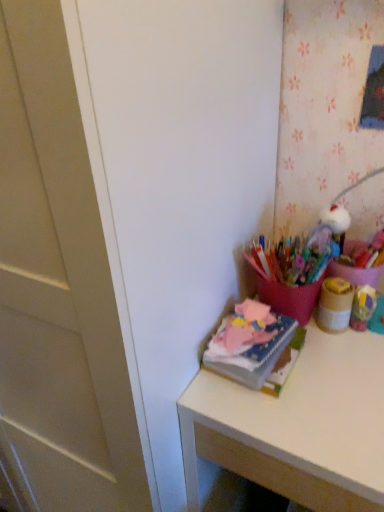
Image resolution: width=384 pixels, height=512 pixels. Identify the location of matte pink desk at right. (297, 426).

What are the coordinates of `soft pink fabric at upper right` in the screenshot? It's located at (249, 344).

From the picture: Measure the distance from matte brown jar at upper right to matte pink desk at right.

A distance of 22.34 centimeters exists between matte brown jar at upper right and matte pink desk at right.

Can you tell me how much matte brown jar at upper right and matte pink desk at right differ in facing direction?

They differ by 0.00192 degrees in their facing directions.

From the image's perspective, is matte brown jar at upper right located above or below matte pink desk at right?

matte brown jar at upper right is above matte pink desk at right.

Is matte brown jar at upper right bigger or smaller than matte pink desk at right?

In the image, matte brown jar at upper right appears to be smaller than matte pink desk at right.

Considering the relative sizes of matte pink desk at right and matte brown jar at upper right in the image provided, is matte pink desk at right thinner than matte brown jar at upper right?

No.

From the image's perspective, relative to matte brown jar at upper right, is matte pink desk at right above or below?

From the image's perspective, matte pink desk at right appears below matte brown jar at upper right.

Is matte pink desk at right not near matte brown jar at upper right?

They are positioned close to each other.

Is there a large distance between soft pink fabric at upper right and matte brown jar at upper right?

soft pink fabric at upper right is actually quite close to matte brown jar at upper right.

Considering the relative sizes of soft pink fabric at upper right and matte brown jar at upper right in the image provided, is soft pink fabric at upper right shorter than matte brown jar at upper right?

Yes.

Is soft pink fabric at upper right positioned beyond the bounds of matte brown jar at upper right?

That's correct, soft pink fabric at upper right is outside of matte brown jar at upper right.

From a real-world perspective, is soft pink fabric at upper right physically below matte pink desk at right?

No, from a real-world perspective, soft pink fabric at upper right is not under matte pink desk at right.

Consider the image. From the image's perspective, which is below, soft pink fabric at upper right or matte pink desk at right?

matte pink desk at right appears lower in the image.

Is soft pink fabric at upper right not close to matte pink desk at right?

That's not correct — soft pink fabric at upper right is a little close to matte pink desk at right.

Which is closer to the camera, [227,353] or [379,507]?

Positioned in front is point [379,507].

Is matte pink desk at right not near soft pink fabric at upper right?

No.

Can you confirm if matte pink desk at right is positioned to the right of soft pink fabric at upper right?

Correct, you'll find matte pink desk at right to the right of soft pink fabric at upper right.

Is matte pink desk at right further to camera compared to soft pink fabric at upper right?

No, it is in front of soft pink fabric at upper right.

In the image, there is a matte pink desk at right. Where is `book above it (from the image's perspective)`? book above it (from the image's perspective) is located at coordinates (249, 344).

Based on the photo, does matte brown jar at upper right appear on the right side of soft pink fabric at upper right?

Indeed, matte brown jar at upper right is positioned on the right side of soft pink fabric at upper right.

Would you consider matte brown jar at upper right to be distant from soft pink fabric at upper right?

No, there isn't a large distance between matte brown jar at upper right and soft pink fabric at upper right.

Considering their positions, is matte brown jar at upper right located in front of or behind soft pink fabric at upper right?

matte brown jar at upper right is positioned farther from the viewer than soft pink fabric at upper right.

The image size is (384, 512). What are the coordinates of `book below the matte brown jar at upper right (from the image's perspective)` in the screenshot? It's located at (249, 344).

In the image, there is a matte brown jar at upper right. Where is `desk below it (from a real-world perspective)`? desk below it (from a real-world perspective) is located at coordinates (297, 426).

The image size is (384, 512). I want to click on desk in front of the matte brown jar at upper right, so click(x=297, y=426).

From the image, which object appears to be farther from matte pink desk at right, matte brown jar at upper right or soft pink fabric at upper right?

Based on the image, matte brown jar at upper right appears to be further to matte pink desk at right.

Considering their positions, is matte pink desk at right positioned closer to matte brown jar at upper right than soft pink fabric at upper right?

The object closer to matte brown jar at upper right is soft pink fabric at upper right.

When comparing their distances from matte brown jar at upper right, does soft pink fabric at upper right or matte pink desk at right seem further?

Based on the image, matte pink desk at right appears to be further to matte brown jar at upper right.

Consider the image. Considering their positions, is matte pink desk at right positioned further to soft pink fabric at upper right than matte brown jar at upper right?

The object further to soft pink fabric at upper right is matte brown jar at upper right.

Estimate the real-world distances between objects in this image. Which object is closer to soft pink fabric at upper right, matte brown jar at upper right or matte pink desk at right?

Among the two, matte pink desk at right is located nearer to soft pink fabric at upper right.

Estimate the real-world distances between objects in this image. Which object is closer to matte pink desk at right, soft pink fabric at upper right or matte brown jar at upper right?

The object closer to matte pink desk at right is soft pink fabric at upper right.

You are a GUI agent. You are given a task and a screenshot of the screen. Output one action in this format:
    pyautogui.click(x=<x>, y=<y>)
    Task: Click on the book between matte brown jar at upper right and matte pink desk at right from top to bottom
    The width and height of the screenshot is (384, 512).
    Given the screenshot: What is the action you would take?
    pyautogui.click(x=249, y=344)